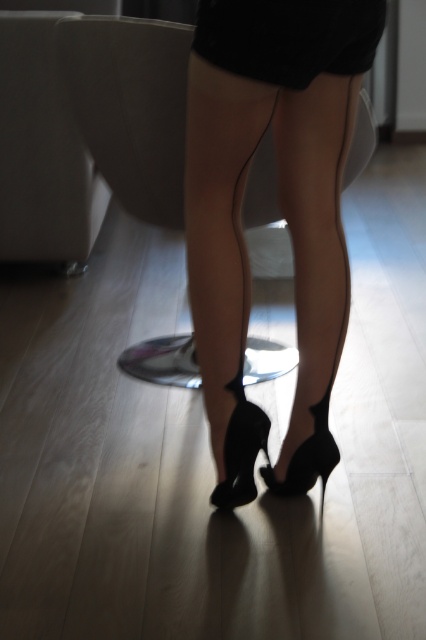
Is black satin stockings at center taller than black leather high-heeled shoe at center?

Correct, black satin stockings at center is much taller as black leather high-heeled shoe at center.

Can you confirm if black satin stockings at center is smaller than black leather high-heeled shoe at center?

Incorrect, black satin stockings at center is not smaller in size than black leather high-heeled shoe at center.

Does point (319, 205) come farther from viewer compared to point (244, 467)?

No, (319, 205) is in front of (244, 467).

Locate an element on the screen. Image resolution: width=426 pixels, height=640 pixels. black satin stockings at center is located at coordinates (313, 266).

Measure the distance from black suede heels at center to black satin stockings at center.

9.98 centimeters

Does black suede heels at center lie behind black satin stockings at center?

No.

Who is more forward, (221, 406) or (319, 83)?

Point (319, 83) is in front.

Locate an element on the screen. This screenshot has height=640, width=426. black suede heels at center is located at coordinates (282, 211).

Who is lower down, black suede heels at center or black matte dress at center?

Positioned lower is black suede heels at center.

Looking at this image, is black suede heels at center bigger than black matte dress at center?

Yes, black suede heels at center is bigger than black matte dress at center.

Where is `black suede heels at center`? This screenshot has height=640, width=426. black suede heels at center is located at coordinates (282, 211).

This screenshot has width=426, height=640. I want to click on black suede heels at center, so click(282, 211).